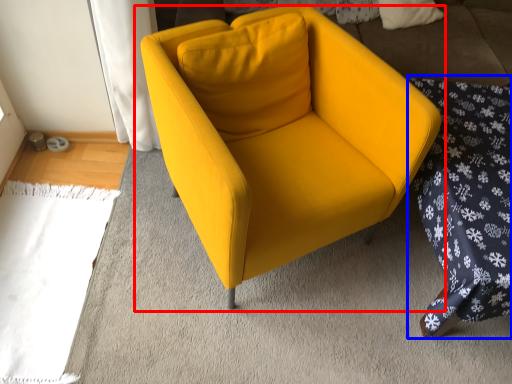
Question: Which of the following is the farthest to the observer, chair (highlighted by a red box) or bedding (highlighted by a blue box)?

Choices:
 (A) chair
 (B) bedding

Answer: (B)